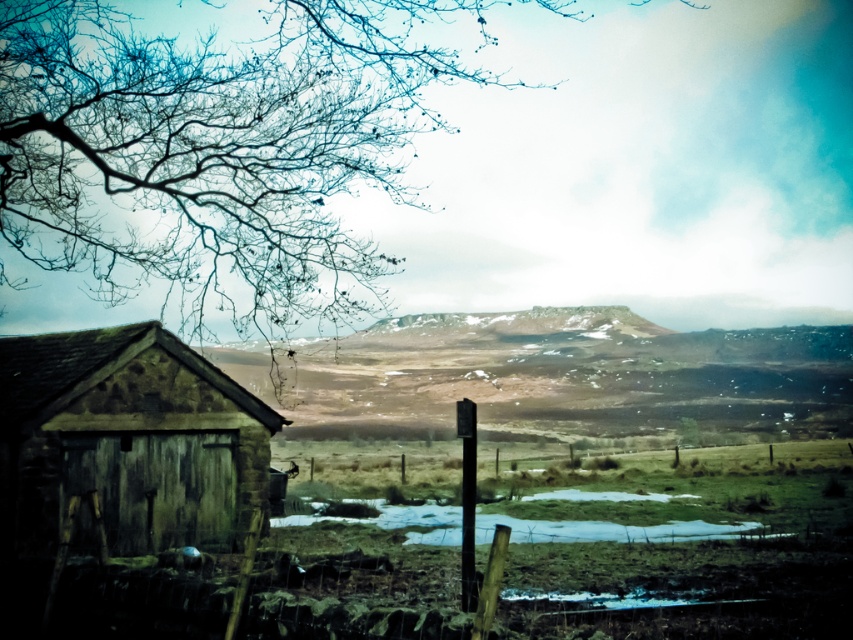
You are standing in the middle of the field looking at the scene. Which object, the bare branches at upper left or the rustic wooden hut at left, has a greater width?

The bare branches at upper left has a greater width than the rustic wooden hut at left according to the description.

You are standing in the middle of the field looking at the scene. Which object is closer to you between the bare branches at upper left and the rustic wooden hut at left?

The bare branches at upper left are closer to you because they are positioned further to the viewer than the rustic wooden hut at left, meaning they are nearer in the visual perspective.